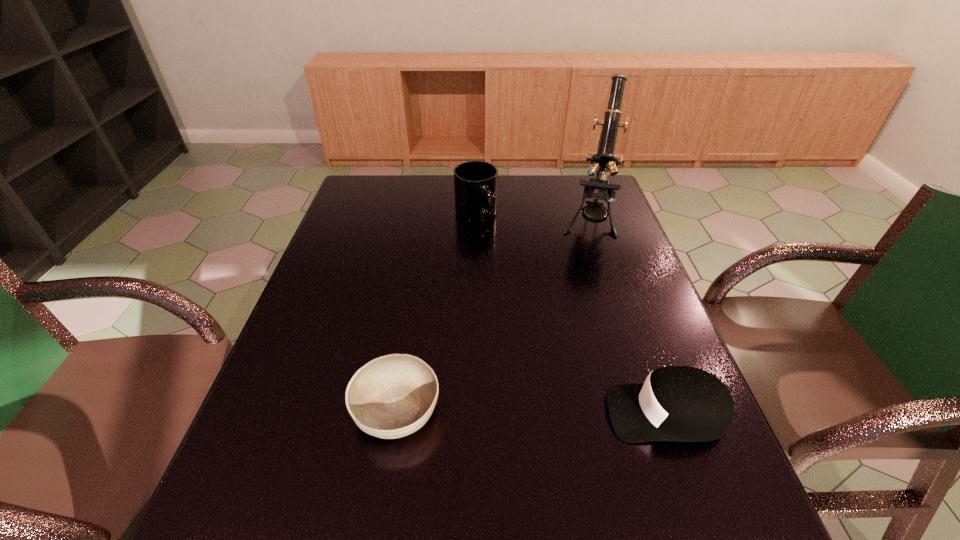
Locate an element on the screen. vacant position located 0.330m with the handle on the side of the mug is located at coordinates (501, 303).

What are the coordinates of `vacant area situated through the eyepiece of the microscope` in the screenshot? It's located at (579, 319).

Find the location of a particular element. This screenshot has height=540, width=960. vacant space located 0.260m through the eyepiece of the microscope is located at coordinates (580, 310).

Find the location of `free region located through the eyepiece of the microscope`. free region located through the eyepiece of the microscope is located at coordinates (584, 285).

Identify the location of mug present at the far edge. This screenshot has width=960, height=540. click(475, 182).

Identify the location of microscope that is at the far edge. The width and height of the screenshot is (960, 540). pos(604,161).

The image size is (960, 540). Identify the location of bowl that is at the near edge. (392, 396).

What are the coordinates of `cap situated at the near edge` in the screenshot? It's located at (675, 403).

At what (x,y) coordinates should I click in order to perform the action: click on cap at the right edge. Please return your answer as a coordinate pair (x, y). Looking at the image, I should click on (675, 403).

Where is `microscope located in the right edge section of the desktop`? The height and width of the screenshot is (540, 960). microscope located in the right edge section of the desktop is located at coordinates (604, 161).